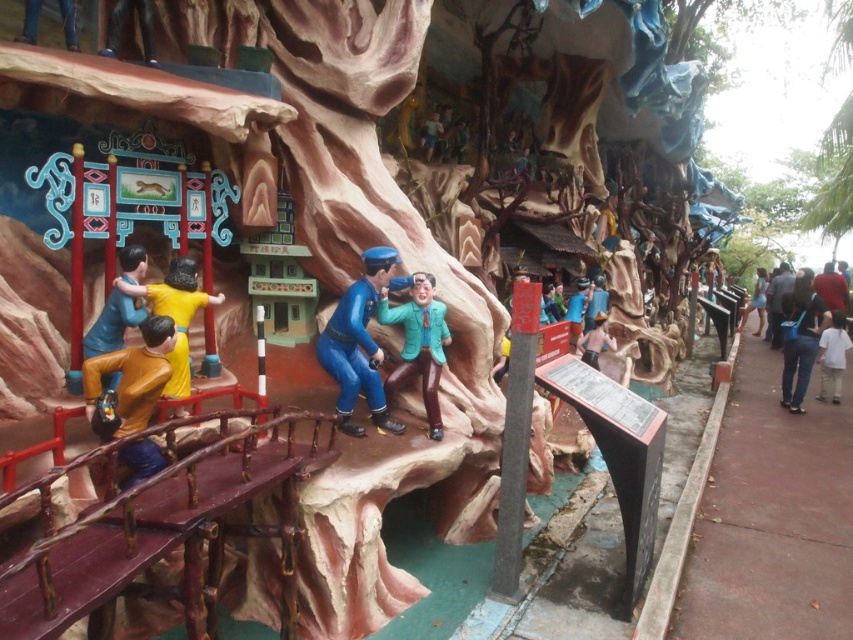
Question: Based on their relative distances, which object is nearer to the light blue denim jeans at right?

Choices:
 (A) dark blue uniform at right
 (B) blue glossy uniform at center
 (C) white cotton shirt at right

Answer: (C)

Question: Does teal matte jacket at center appear over red fabric shirt at right?

Choices:
 (A) no
 (B) yes

Answer: (A)

Question: Is matte yellow jacket at lower left positioned at the back of dark blue uniform at right?

Choices:
 (A) yes
 (B) no

Answer: (B)

Question: Which object is positioned farthest from the red fabric shirt at right?

Choices:
 (A) matte yellow jacket at lower left
 (B) jeans at right
 (C) white cotton shirt at right

Answer: (A)

Question: Does yellow matte figure at center have a larger size compared to red fabric shirt at right?

Choices:
 (A) no
 (B) yes

Answer: (A)

Question: Among these points, which one is nearest to the camera?

Choices:
 (A) (177, 308)
 (B) (779, 266)
 (C) (833, 362)

Answer: (A)